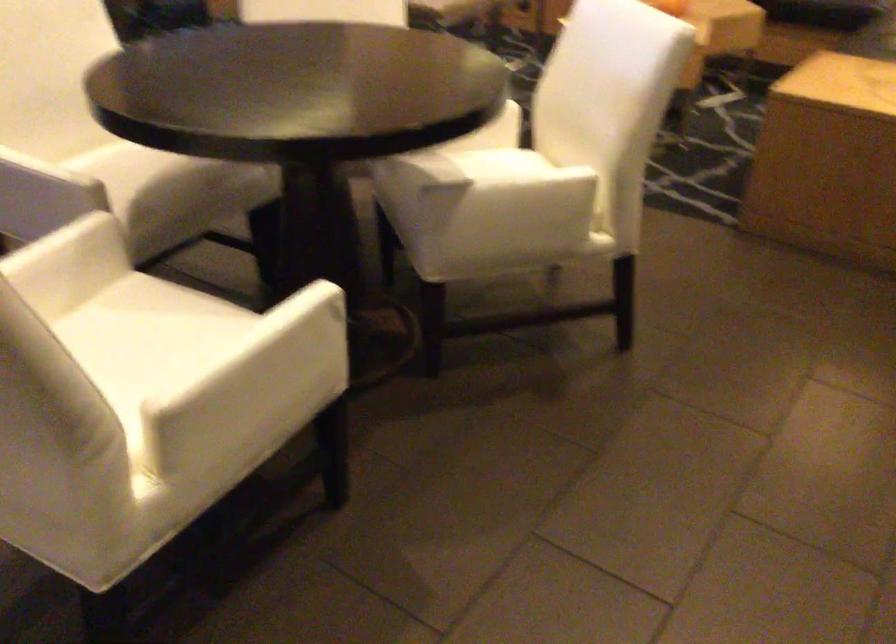
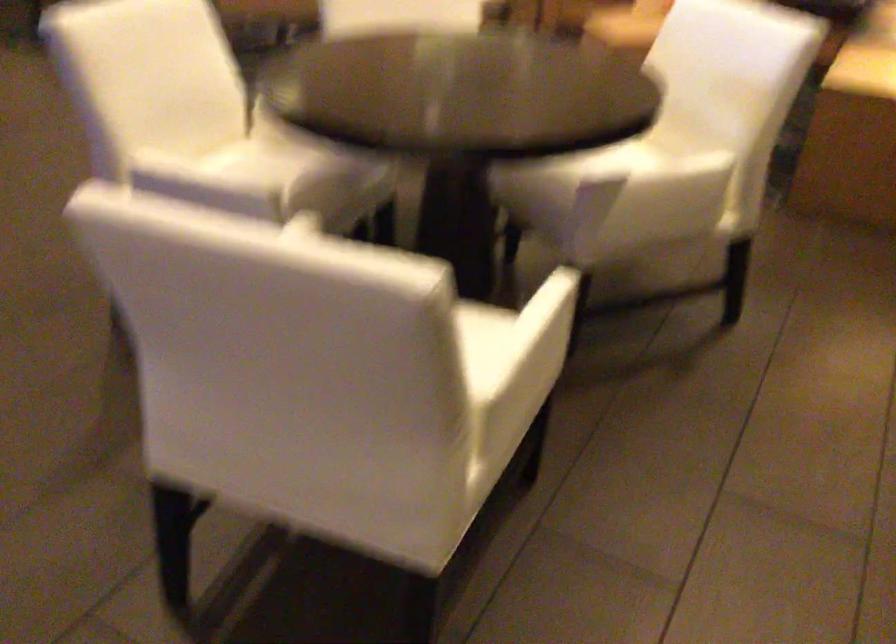
Question: What movement of the cameraman would produce the second image?

Choices:
 (A) Left
 (B) Right
 (C) Forward
 (D) Backward

Answer: (A)